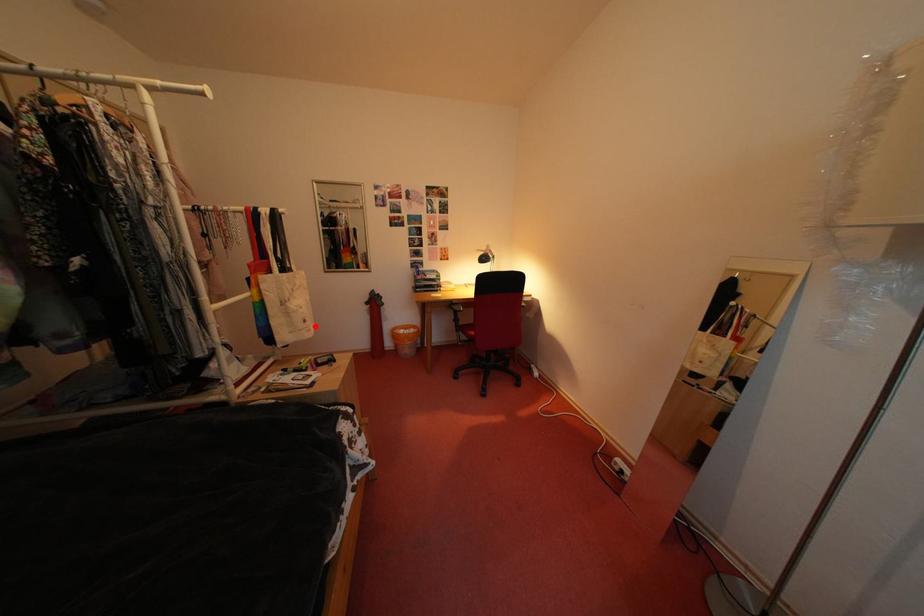
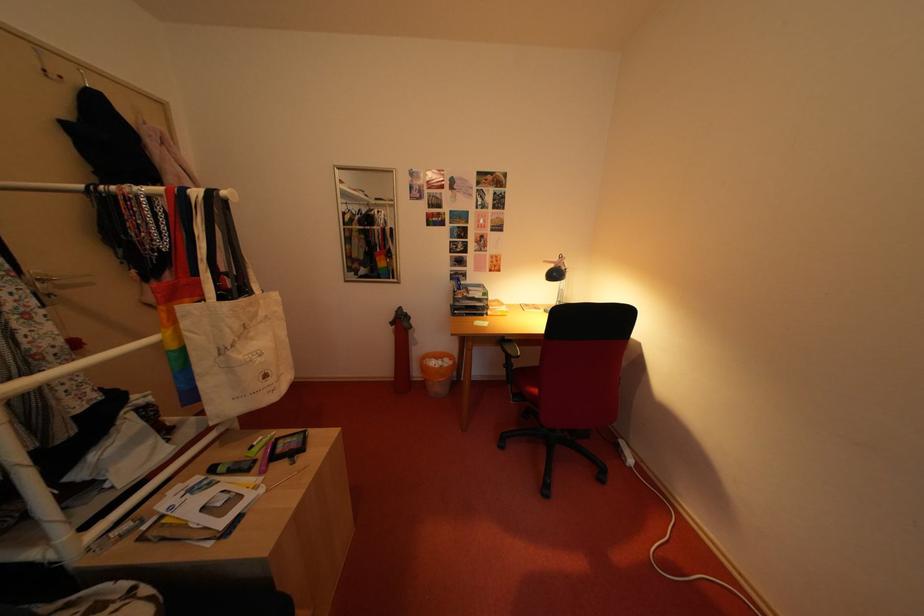
In the second image, find the point that corresponds to the highlighted location in the first image.

(275, 381)